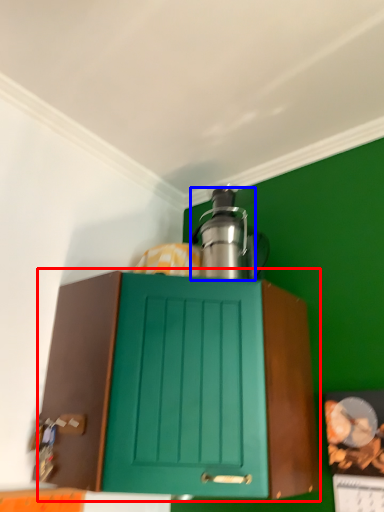
Question: Among these objects, which one is nearest to the camera, cabinetry (highlighted by a red box) or kitchen appliance (highlighted by a blue box)?

Choices:
 (A) cabinetry
 (B) kitchen appliance

Answer: (A)